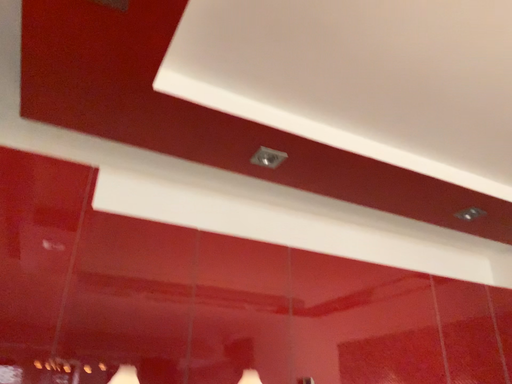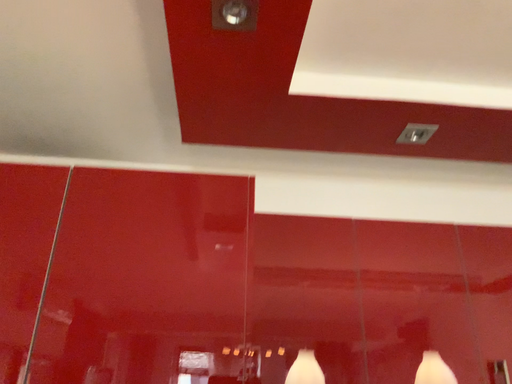
Question: How did the camera likely rotate when shooting the video?

Choices:
 (A) rotated right
 (B) rotated left

Answer: (B)